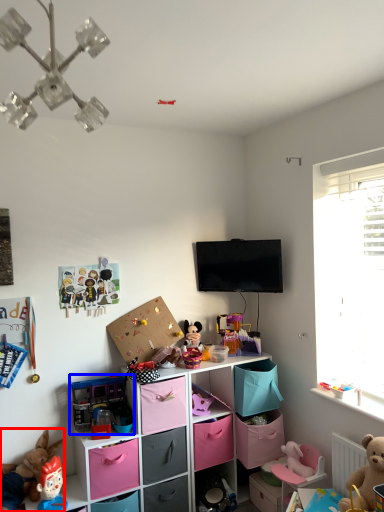
Question: Which object appears farthest to the camera in this image, toy (highlighted by a red box) or toy (highlighted by a blue box)?

Choices:
 (A) toy
 (B) toy

Answer: (B)